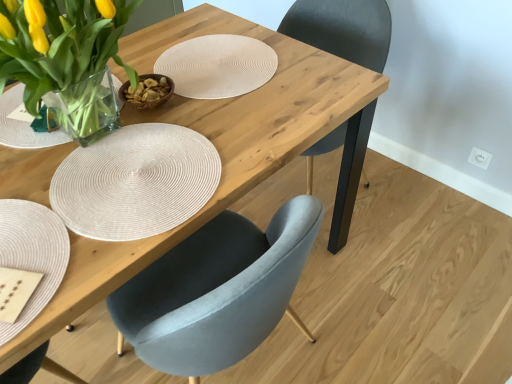
Question: Does matte gray chair at center have a greater width compared to beige woven placemat at lower left?

Choices:
 (A) yes
 (B) no

Answer: (A)

Question: From the image's perspective, is matte gray chair at center over beige woven placemat at lower left?

Choices:
 (A) no
 (B) yes

Answer: (B)

Question: Is matte gray chair at center facing away from beige woven placemat at lower left?

Choices:
 (A) yes
 (B) no

Answer: (B)

Question: Considering the relative sizes of matte gray chair at center and beige woven placemat at lower left in the image provided, is matte gray chair at center shorter than beige woven placemat at lower left?

Choices:
 (A) no
 (B) yes

Answer: (A)

Question: Can you confirm if matte gray chair at center is positioned to the right of beige woven placemat at lower left?

Choices:
 (A) yes
 (B) no

Answer: (A)

Question: Is matte gray chair at center thinner than beige woven placemat at lower left?

Choices:
 (A) yes
 (B) no

Answer: (B)

Question: From a real-world perspective, does beige woven placemat at lower left stand above clear glass vase at upper left?

Choices:
 (A) yes
 (B) no

Answer: (B)

Question: Is beige woven placemat at lower left shorter than clear glass vase at upper left?

Choices:
 (A) no
 (B) yes

Answer: (B)

Question: Is beige woven placemat at lower left next to clear glass vase at upper left?

Choices:
 (A) yes
 (B) no

Answer: (B)

Question: From the image's perspective, is beige woven placemat at lower left on clear glass vase at upper left?

Choices:
 (A) no
 (B) yes

Answer: (A)

Question: Is beige woven placemat at lower left further to the viewer compared to clear glass vase at upper left?

Choices:
 (A) yes
 (B) no

Answer: (B)

Question: Is there a large distance between beige woven placemat at lower left and clear glass vase at upper left?

Choices:
 (A) yes
 (B) no

Answer: (B)

Question: Are clear glass vase at upper left and matte gray chair at center far apart?

Choices:
 (A) yes
 (B) no

Answer: (B)